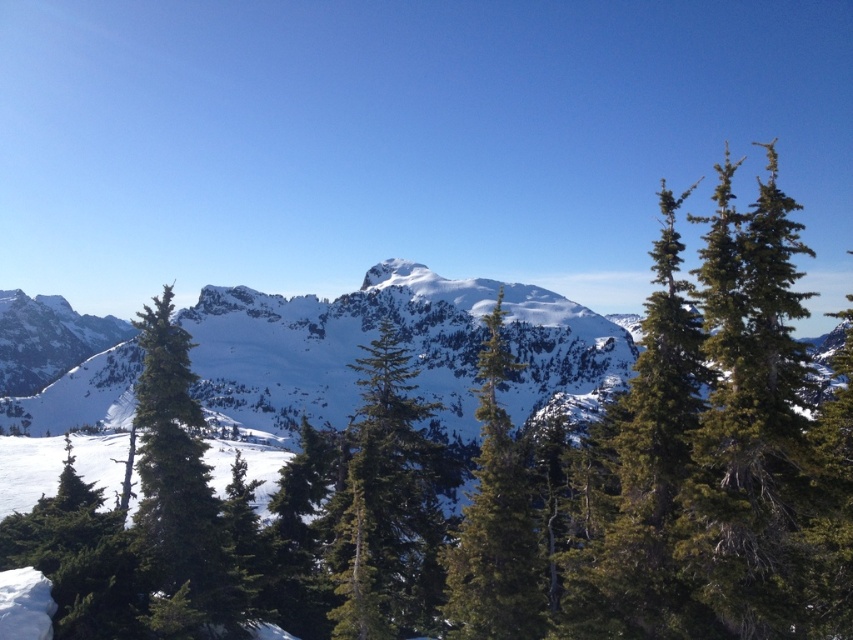
Question: Does green textured tree at center appear under green textured pine tree at center?

Choices:
 (A) yes
 (B) no

Answer: (A)

Question: Can you confirm if green textured tree at center is thinner than green textured pine tree at center?

Choices:
 (A) yes
 (B) no

Answer: (B)

Question: Is green textured tree at center thinner than green textured pine tree at center?

Choices:
 (A) yes
 (B) no

Answer: (B)

Question: Which point is closer to the camera?

Choices:
 (A) green textured tree at center
 (B) green textured pine tree at center

Answer: (A)

Question: Which of the following is the closest to the observer?

Choices:
 (A) (468, 532)
 (B) (399, 580)

Answer: (A)